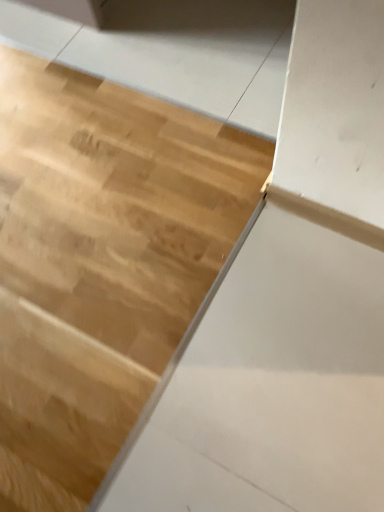
What do you see at coordinates (100, 263) in the screenshot?
I see `natural wood stairs at lower left` at bounding box center [100, 263].

Locate an element on the screen. This screenshot has width=384, height=512. natural wood stairs at lower left is located at coordinates (100, 263).

What is the approximate height of natural wood stairs at lower left?

3.30 inches.

I want to click on natural wood stairs at lower left, so click(100, 263).